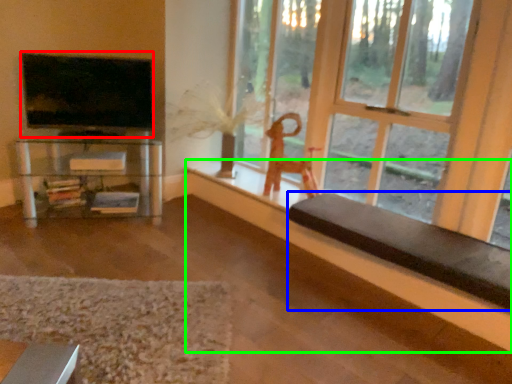
Question: Which object is the closest to the television (highlighted by a red box)? Choose among these: furniture (highlighted by a blue box) or ledge (highlighted by a green box).

Choices:
 (A) furniture
 (B) ledge

Answer: (B)